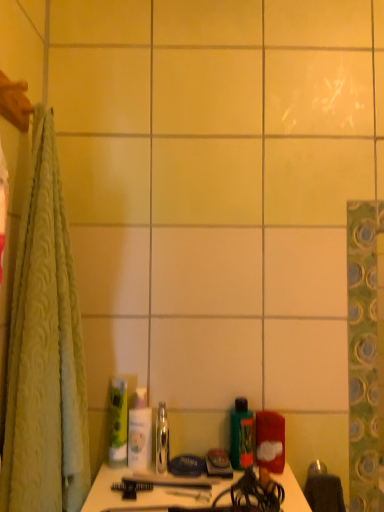
Measure the distance between green matte tube at center, the first toiletry when ordered from left to right, and camera.

The distance of green matte tube at center, the first toiletry when ordered from left to right, from camera is 34.80 inches.

At what (x,y) coordinates should I click in order to perform the action: click on matte red container at lower right, which is counted as the 1th toiletry, starting from the right. Please return your answer as a coordinate pair (x, y). Image resolution: width=384 pixels, height=512 pixels. Looking at the image, I should click on (270, 441).

Would you say green matte bottle at center, arranged as the first mouthwash when viewed from the right, is part of matte red container at lower right, which is the third toiletry in left-to-right order,'s contents?

No.

Does matte red container at lower right, which is the third toiletry in left-to-right order, touch green matte bottle at center, which is the second mouthwash from left to right?

Absolutely, matte red container at lower right, which is the third toiletry in left-to-right order, is next to and touching green matte bottle at center, which is the second mouthwash from left to right.

Is matte red container at lower right, which is the third toiletry in left-to-right order, positioned in front of green matte bottle at center, which is the second mouthwash from left to right?

That is True.

Is matte red container at lower right, which is the third toiletry in left-to-right order, facing away from green matte bottle at center, arranged as the first mouthwash when viewed from the right?

That's not correct — matte red container at lower right, which is the third toiletry in left-to-right order, is not looking away from green matte bottle at center, arranged as the first mouthwash when viewed from the right.

Is the position of clear plastic mouthwash at center, placed as the first mouthwash when sorted from left to right, less distant than that of green matte bottle at center, which is the second mouthwash from left to right?

Yes, clear plastic mouthwash at center, placed as the first mouthwash when sorted from left to right, is closer to the camera.

What's the angular difference between clear plastic mouthwash at center, arranged as the 2th mouthwash when viewed from the right, and green matte bottle at center, arranged as the first mouthwash when viewed from the right,'s facing directions?

clear plastic mouthwash at center, arranged as the 2th mouthwash when viewed from the right, and green matte bottle at center, arranged as the first mouthwash when viewed from the right, are facing 6.18e-05 degrees away from each other.

How far apart are clear plastic mouthwash at center, placed as the first mouthwash when sorted from left to right, and green matte bottle at center, which is the second mouthwash from left to right?

They are 15.57 centimeters apart.

From a real-world perspective, who is located higher, clear plastic mouthwash at center, placed as the first mouthwash when sorted from left to right, or green matte bottle at center, which is the second mouthwash from left to right?

Answer: green matte bottle at center, which is the second mouthwash from left to right, from a real-world perspective.

Considering the positions of points (112, 399) and (278, 435), is point (112, 399) farther from camera compared to point (278, 435)?

Yes, it is.

Between green matte tube at center, the 3th toiletry viewed from the right, and matte red container at lower right, which is counted as the 1th toiletry, starting from the right, which one appears on the right side from the viewer's perspective?

Positioned to the right is matte red container at lower right, which is counted as the 1th toiletry, starting from the right.

From a real-world perspective, is green matte tube at center, the 3th toiletry viewed from the right, located higher than matte red container at lower right, which is the third toiletry in left-to-right order?

Yes, from a real-world perspective, green matte tube at center, the 3th toiletry viewed from the right, is on top of matte red container at lower right, which is the third toiletry in left-to-right order.

Is green matte tube at center, the first toiletry when ordered from left to right, smaller than matte red container at lower right, which is counted as the 1th toiletry, starting from the right?

Correct, green matte tube at center, the first toiletry when ordered from left to right, occupies less space than matte red container at lower right, which is counted as the 1th toiletry, starting from the right.

How different are the orientations of green matte bottle at center, which is the second mouthwash from left to right, and matte red container at lower right, which is the third toiletry in left-to-right order, in degrees?

The angular difference between green matte bottle at center, which is the second mouthwash from left to right, and matte red container at lower right, which is the third toiletry in left-to-right order, is 6.11e-05 degrees.

Between green matte bottle at center, which is the second mouthwash from left to right, and matte red container at lower right, which is counted as the 1th toiletry, starting from the right, which one appears on the right side from the viewer's perspective?

From the viewer's perspective, matte red container at lower right, which is counted as the 1th toiletry, starting from the right, appears more on the right side.

Between green matte bottle at center, arranged as the first mouthwash when viewed from the right, and matte red container at lower right, which is the third toiletry in left-to-right order, which one has smaller size?

Smaller between the two is green matte bottle at center, arranged as the first mouthwash when viewed from the right.

Is green matte bottle at center, which is the second mouthwash from left to right, facing towards matte red container at lower right, which is counted as the 1th toiletry, starting from the right?

No, green matte bottle at center, which is the second mouthwash from left to right, is not turned towards matte red container at lower right, which is counted as the 1th toiletry, starting from the right.

Would you say white glossy lotion at center, arranged as the 2th toiletry when viewed from the right, is a long distance from clear plastic mouthwash at center, placed as the first mouthwash when sorted from left to right?

That's not correct — white glossy lotion at center, arranged as the 2th toiletry when viewed from the right, is a little close to clear plastic mouthwash at center, placed as the first mouthwash when sorted from left to right.

Does white glossy lotion at center, placed as the 2th toiletry when sorted from left to right, have a smaller size compared to clear plastic mouthwash at center, placed as the first mouthwash when sorted from left to right?

No, white glossy lotion at center, placed as the 2th toiletry when sorted from left to right, is not smaller than clear plastic mouthwash at center, placed as the first mouthwash when sorted from left to right.

Between point (139, 447) and point (165, 446), which one is positioned in front?

The point (139, 447) is closer to the camera.

How different are the orientations of white glossy lotion at center, placed as the 2th toiletry when sorted from left to right, and clear plastic mouthwash at center, placed as the first mouthwash when sorted from left to right, in degrees?

The angle between the facing direction of white glossy lotion at center, placed as the 2th toiletry when sorted from left to right, and the facing direction of clear plastic mouthwash at center, placed as the first mouthwash when sorted from left to right, is 1.67e-05 degrees.

Is clear plastic mouthwash at center, placed as the first mouthwash when sorted from left to right, smaller than green matte tube at center, the first toiletry when ordered from left to right?

Yes.

In the image, is clear plastic mouthwash at center, placed as the first mouthwash when sorted from left to right, positioned in front of or behind green matte tube at center, the 3th toiletry viewed from the right?

clear plastic mouthwash at center, placed as the first mouthwash when sorted from left to right, is positioned closer to the viewer than green matte tube at center, the 3th toiletry viewed from the right.

What's the angular difference between clear plastic mouthwash at center, arranged as the 2th mouthwash when viewed from the right, and green matte tube at center, the 3th toiletry viewed from the right,'s facing directions?

The angular difference between clear plastic mouthwash at center, arranged as the 2th mouthwash when viewed from the right, and green matte tube at center, the 3th toiletry viewed from the right, is 6.67e-05 degrees.

Is clear plastic mouthwash at center, arranged as the 2th mouthwash when viewed from the right, not close to green matte tube at center, the 3th toiletry viewed from the right?

No, clear plastic mouthwash at center, arranged as the 2th mouthwash when viewed from the right, is in close proximity to green matte tube at center, the 3th toiletry viewed from the right.

Which object is wider, matte red container at lower right, which is counted as the 1th toiletry, starting from the right, or white glossy lotion at center, arranged as the 2th toiletry when viewed from the right?

matte red container at lower right, which is counted as the 1th toiletry, starting from the right, is wider.

How different are the orientations of matte red container at lower right, which is the third toiletry in left-to-right order, and white glossy lotion at center, placed as the 2th toiletry when sorted from left to right, in degrees?

2.41e-05 degrees separate the facing orientations of matte red container at lower right, which is the third toiletry in left-to-right order, and white glossy lotion at center, placed as the 2th toiletry when sorted from left to right.

Is matte red container at lower right, which is counted as the 1th toiletry, starting from the right, not close to white glossy lotion at center, arranged as the 2th toiletry when viewed from the right?

No.

From a real-world perspective, is matte red container at lower right, which is the third toiletry in left-to-right order, on top of white glossy lotion at center, placed as the 2th toiletry when sorted from left to right?

No, from a real-world perspective, matte red container at lower right, which is the third toiletry in left-to-right order, is not over white glossy lotion at center, placed as the 2th toiletry when sorted from left to right

Locate an element on the screen. The height and width of the screenshot is (512, 384). toiletry in front of the green matte bottle at center, which is the second mouthwash from left to right is located at coordinates coord(270,441).

You are a GUI agent. You are given a task and a screenshot of the screen. Output one action in this format:
    pyautogui.click(x=<x>, y=<y>)
    Task: Click on the mouthwash lying behind the clear plastic mouthwash at center, placed as the first mouthwash when sorted from left to right
    
    Given the screenshot: What is the action you would take?
    pyautogui.click(x=241, y=435)

Looking at the image, which one is located closer to green matte tube at center, the 3th toiletry viewed from the right, green matte bottle at center, arranged as the first mouthwash when viewed from the right, or clear plastic mouthwash at center, placed as the first mouthwash when sorted from left to right?

The object closer to green matte tube at center, the 3th toiletry viewed from the right, is clear plastic mouthwash at center, placed as the first mouthwash when sorted from left to right.

Looking at this image, when comparing their distances from matte red container at lower right, which is the third toiletry in left-to-right order, does white glossy lotion at center, placed as the 2th toiletry when sorted from left to right, or clear plastic mouthwash at center, arranged as the 2th mouthwash when viewed from the right, seem further?

Based on the image, white glossy lotion at center, placed as the 2th toiletry when sorted from left to right, appears to be further to matte red container at lower right, which is the third toiletry in left-to-right order.

Which object lies further to the anchor point white glossy lotion at center, placed as the 2th toiletry when sorted from left to right, green matte tube at center, the 3th toiletry viewed from the right, or matte red container at lower right, which is the third toiletry in left-to-right order?

matte red container at lower right, which is the third toiletry in left-to-right order, is positioned further to the anchor white glossy lotion at center, placed as the 2th toiletry when sorted from left to right.

Consider the image. From the image, which object appears to be nearer to green matte tube at center, the 3th toiletry viewed from the right, matte red container at lower right, which is the third toiletry in left-to-right order, or green matte bottle at center, arranged as the first mouthwash when viewed from the right?

green matte bottle at center, arranged as the first mouthwash when viewed from the right.

Which object lies further to the anchor point green matte bottle at center, which is the second mouthwash from left to right, clear plastic mouthwash at center, arranged as the 2th mouthwash when viewed from the right, or green matte tube at center, the first toiletry when ordered from left to right?

Based on the image, green matte tube at center, the first toiletry when ordered from left to right, appears to be further to green matte bottle at center, which is the second mouthwash from left to right.

Based on their spatial positions, is clear plastic mouthwash at center, arranged as the 2th mouthwash when viewed from the right, or matte red container at lower right, which is the third toiletry in left-to-right order, closer to green matte bottle at center, which is the second mouthwash from left to right?

matte red container at lower right, which is the third toiletry in left-to-right order, lies closer to green matte bottle at center, which is the second mouthwash from left to right, than the other object.

Based on the photo, which object lies nearer to the anchor point matte red container at lower right, which is the third toiletry in left-to-right order, clear plastic mouthwash at center, placed as the first mouthwash when sorted from left to right, or white glossy lotion at center, placed as the 2th toiletry when sorted from left to right?

clear plastic mouthwash at center, placed as the first mouthwash when sorted from left to right, lies closer to matte red container at lower right, which is the third toiletry in left-to-right order, than the other object.

From the image, which object appears to be farther from matte red container at lower right, which is counted as the 1th toiletry, starting from the right, green matte bottle at center, which is the second mouthwash from left to right, or green matte tube at center, the 3th toiletry viewed from the right?

green matte tube at center, the 3th toiletry viewed from the right, is further to matte red container at lower right, which is counted as the 1th toiletry, starting from the right.

Locate an element on the screen. This screenshot has height=512, width=384. toiletry between green matte tube at center, the first toiletry when ordered from left to right, and clear plastic mouthwash at center, placed as the first mouthwash when sorted from left to right, from left to right is located at coordinates (140, 432).

Where is `mouthwash between green matte tube at center, the 3th toiletry viewed from the right, and green matte bottle at center, which is the second mouthwash from left to right, in the horizontal direction`? mouthwash between green matte tube at center, the 3th toiletry viewed from the right, and green matte bottle at center, which is the second mouthwash from left to right, in the horizontal direction is located at coordinates (162, 439).

At what (x,y) coordinates should I click in order to perform the action: click on mouthwash between white glossy lotion at center, arranged as the 2th toiletry when viewed from the right, and green matte bottle at center, which is the second mouthwash from left to right, from left to right. Please return your answer as a coordinate pair (x, y). Image resolution: width=384 pixels, height=512 pixels. Looking at the image, I should click on (162, 439).

Locate an element on the screen. mouthwash between clear plastic mouthwash at center, placed as the first mouthwash when sorted from left to right, and matte red container at lower right, which is counted as the 1th toiletry, starting from the right, in the horizontal direction is located at coordinates (241, 435).